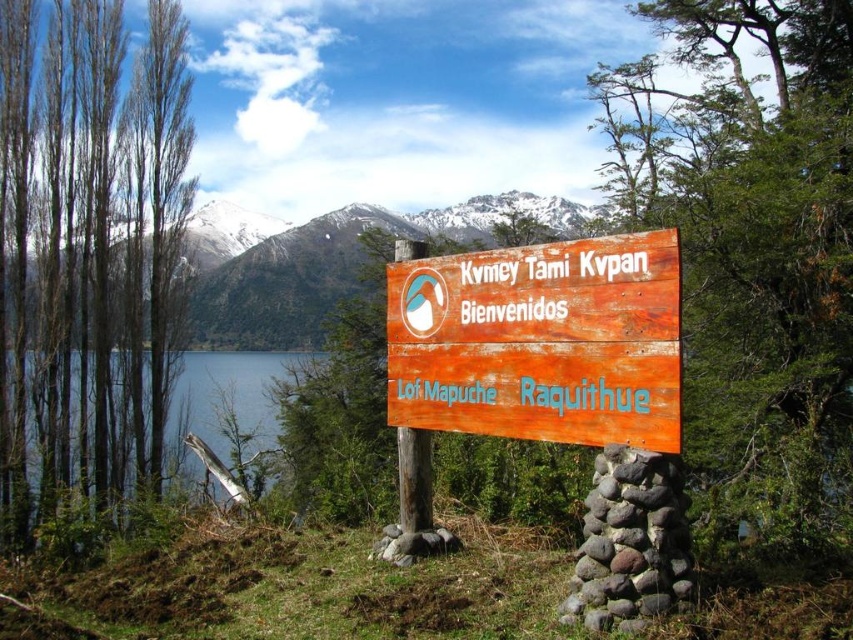
Question: Is wooden sign at center to the left of snowy rock mountain at upper center from the viewer's perspective?

Choices:
 (A) yes
 (B) no

Answer: (B)

Question: Can you confirm if snowy rock mountain at upper center is positioned to the right of blue water at left?

Choices:
 (A) yes
 (B) no

Answer: (A)

Question: Which point is closer to the camera?

Choices:
 (A) wooden sign at center
 (B) snowy rock mountain at upper center
 (C) blue water at left

Answer: (A)

Question: Among these points, which one is nearest to the camera?

Choices:
 (A) (633, 588)
 (B) (228, 374)

Answer: (A)

Question: Which object appears closest to the camera in this image?

Choices:
 (A) snowy rock mountain at upper center
 (B) blue water at left

Answer: (A)

Question: Can you confirm if wooden sign at center is positioned to the left of blue water at left?

Choices:
 (A) no
 (B) yes

Answer: (A)